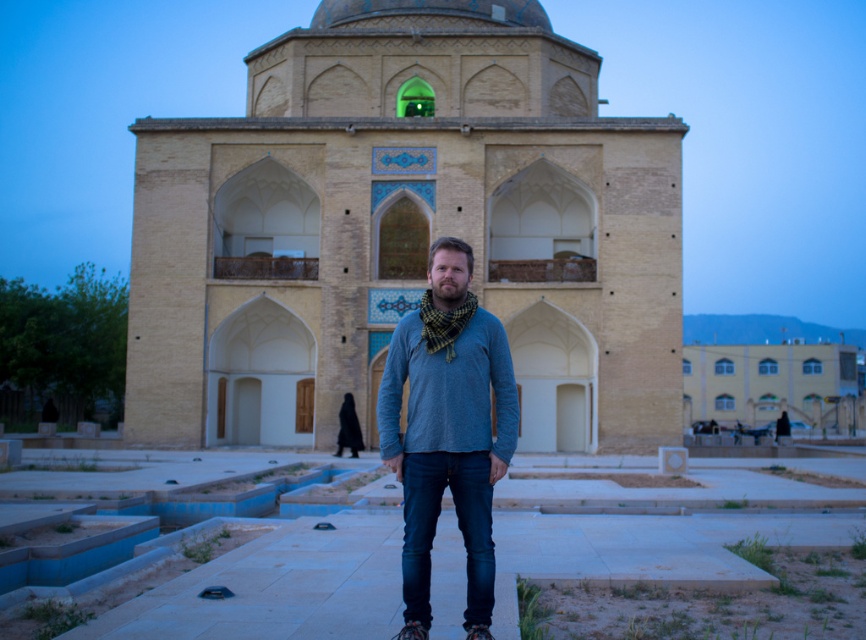
You are standing in front of the beige stone building at center. There is a point marked at coordinates (405, 230). Based on the scene description, where is this point located?

The point marked at coordinates (405, 230) is on the beige stone building at center.

You are a photographer trying to capture the entire beige stone building at center and the matte blue sweater at center in a single frame. Given that your camera can only focus on objects within a 10m height range, will both objects fit vertically in your shot?

The beige stone building at center is taller than the matte blue sweater at center. Since the camera can focus up to 10m, and the building is taller, as long as the building is under 10m in height, both will fit. However, if the building exceeds 10m, only the sweater will be in focus. Without exact measurements, it depends on the building height.